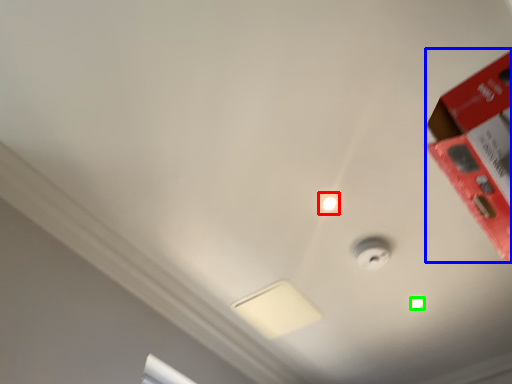
Question: Which object is positioned farthest from droplight (highlighted by a red box)? Select from box (highlighted by a blue box) and light bulb (highlighted by a green box).

Choices:
 (A) box
 (B) light bulb

Answer: (B)